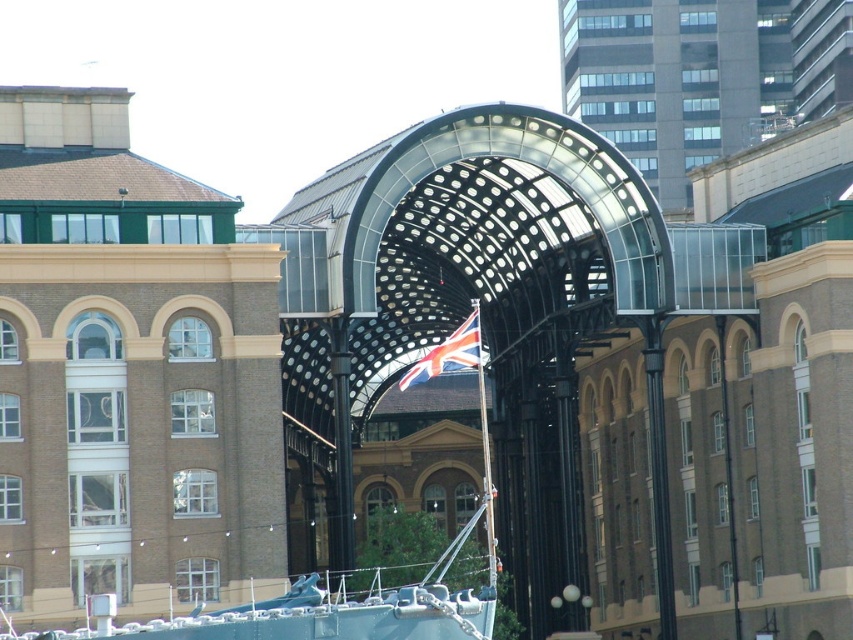
Question: Among these objects, which one is nearest to the camera?

Choices:
 (A) union jack fabric at center
 (B) teal fabric boat at center

Answer: (B)

Question: Does teal fabric boat at center have a larger size compared to union jack fabric at center?

Choices:
 (A) yes
 (B) no

Answer: (A)

Question: Is teal fabric boat at center bigger than union jack fabric at center?

Choices:
 (A) no
 (B) yes

Answer: (B)

Question: Among these points, which one is nearest to the camera?

Choices:
 (A) (241, 621)
 (B) (421, 364)

Answer: (A)

Question: Is teal fabric boat at center to the right of union jack fabric at center from the viewer's perspective?

Choices:
 (A) no
 (B) yes

Answer: (A)